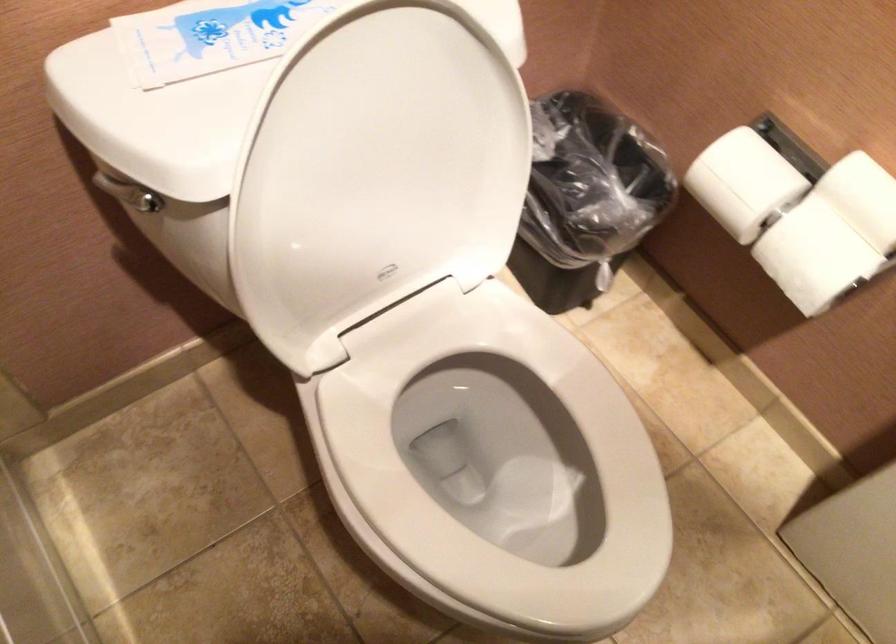
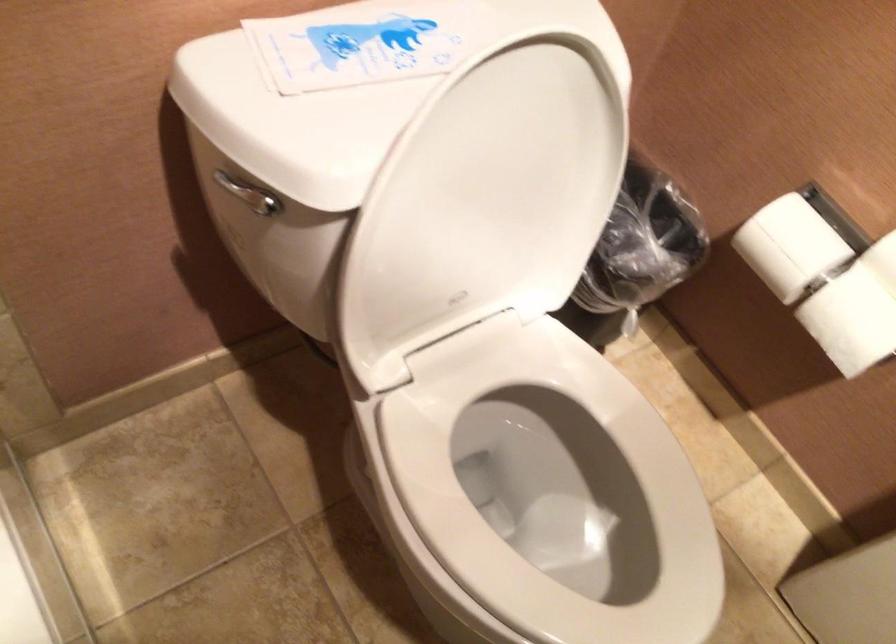
Find the pixel in the second image that matches the point at 808,245 in the first image.

(856, 310)